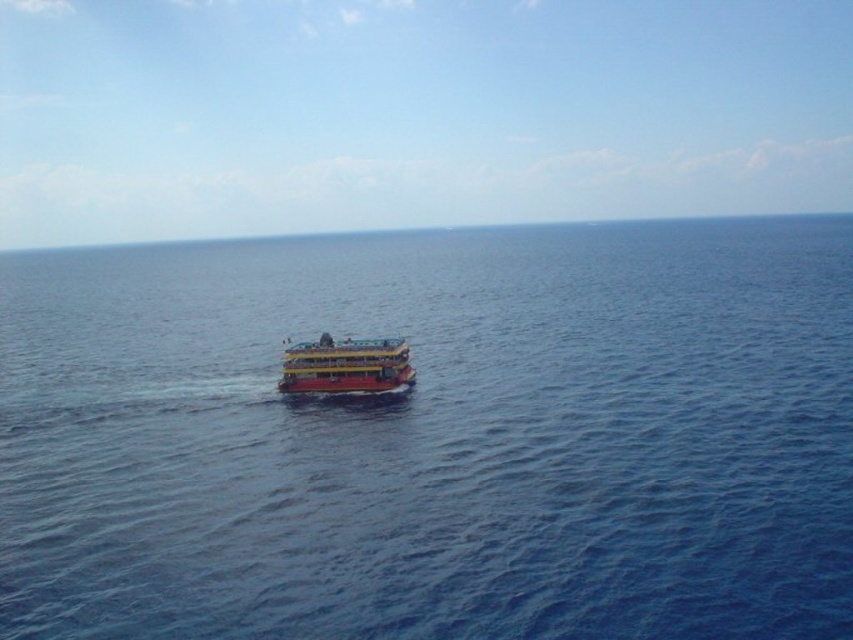
Which is above, blue water at center or yellow matte boat at center?

blue water at center is higher up.

How distant is blue water at center from yellow matte boat at center?

The distance of blue water at center from yellow matte boat at center is 36.13 meters.

Is point (45, 529) closer to viewer compared to point (345, 387)?

Yes, it is.

Find the location of `blue water at center`. blue water at center is located at coordinates (434, 436).